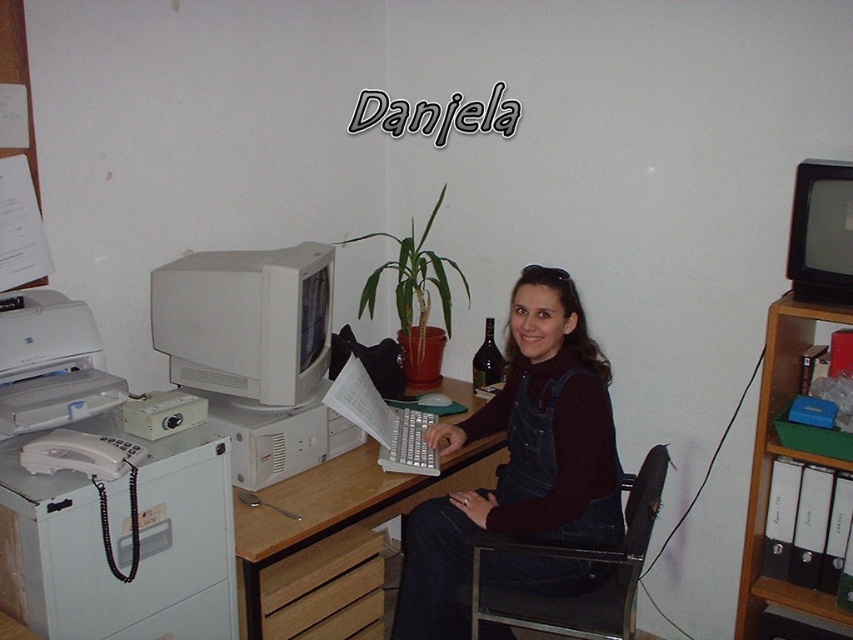
Question: Estimate the real-world distances between objects in this image. Which object is closer to the wooden at lower center?

Choices:
 (A) black plastic monitor at upper right
 (B) metallic black swivel chair at center
 (C) white matte computer monitor at center-left
 (D) wooden at center

Answer: (D)

Question: Considering the relative positions of wooden at center and white plastic printer at left in the image provided, where is wooden at center located with respect to white plastic printer at left?

Choices:
 (A) right
 (B) left

Answer: (A)

Question: Is matte black laptop at center behind black plastic monitor at upper right?

Choices:
 (A) yes
 (B) no

Answer: (A)

Question: From the image, what is the correct spatial relationship of matte black laptop at center in relation to white plastic file cabinet at left?

Choices:
 (A) above
 (B) below

Answer: (A)

Question: Estimate the real-world distances between objects in this image. Which object is farther from the wooden at lower center?

Choices:
 (A) metallic black swivel chair at center
 (B) white matte computer monitor at center-left

Answer: (B)

Question: Based on their relative distances, which object is farther from the wooden at center?

Choices:
 (A) wooden at lower center
 (B) white matte computer monitor at center-left
 (C) metallic black swivel chair at center

Answer: (C)